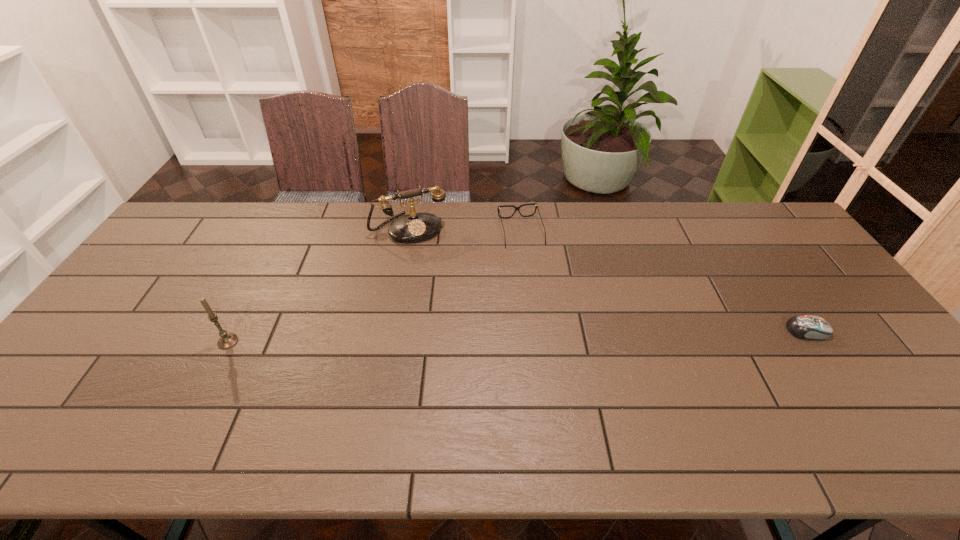
The height and width of the screenshot is (540, 960). What are the coordinates of `candle` in the screenshot? It's located at (226, 341).

Find the location of a particular element. Image resolution: width=960 pixels, height=540 pixels. the shortest object is located at coordinates (812, 327).

Locate an element on the screen. computer mouse is located at coordinates (812, 327).

The image size is (960, 540). Identify the location of telephone. (415, 227).

In order to click on spectacles in this screenshot , I will do `click(536, 207)`.

Identify the location of the third tallest object. The image size is (960, 540). (536, 207).

The width and height of the screenshot is (960, 540). What are the coordinates of `vacant point located 0.120m on the right of the leftmost object` in the screenshot? It's located at (283, 342).

You are a GUI agent. You are given a task and a screenshot of the screen. Output one action in this format:
    pyautogui.click(x=<x>, y=<y>)
    Task: Click on the free region located 0.080m on the wheel side of the shortest object
    
    Given the screenshot: What is the action you would take?
    pyautogui.click(x=857, y=330)

You are a GUI agent. You are given a task and a screenshot of the screen. Output one action in this format:
    pyautogui.click(x=<x>, y=<y>)
    Task: Click on the vacant region located on the dial of the second object from left to right
    
    Given the screenshot: What is the action you would take?
    pyautogui.click(x=425, y=254)

The height and width of the screenshot is (540, 960). In order to click on vacant space located on the dial of the second object from left to right in this screenshot , I will do click(x=449, y=308).